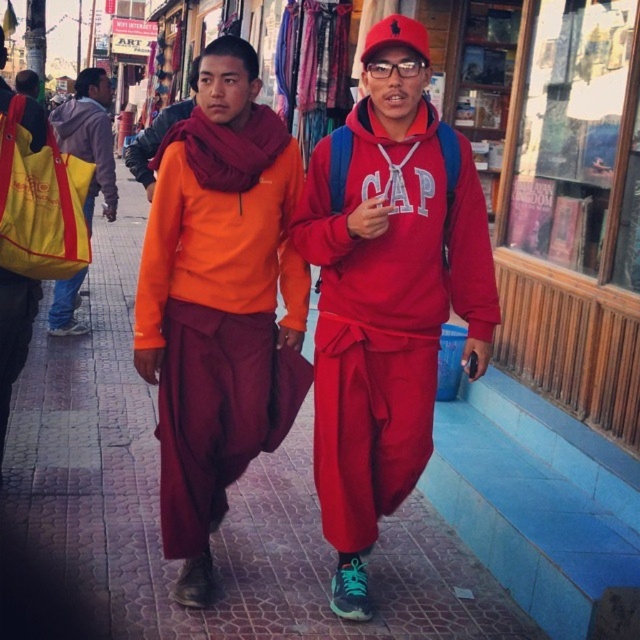
Is matte orange sweater at center smaller than maroon cotton robe at center?

No.

Is point (340, 608) closer to camera compared to point (173, 168)?

No, it is not.

What do you see at coordinates (387, 292) in the screenshot? This screenshot has width=640, height=640. I see `matte orange sweater at center` at bounding box center [387, 292].

Find the location of `matte orange sweater at center`. matte orange sweater at center is located at coordinates (387, 292).

Between point (168, 429) and point (324, 176), which one is positioned in front?

Point (168, 429)

Measure the distance between point (228, 300) and camera.

Point (228, 300) and camera are 2.81 meters apart.

Does point (161, 253) lie in front of point (330, 316)?

Yes, it is in front of point (330, 316).

Find the location of a particular element. maroon cotton robe at center is located at coordinates (220, 310).

Does maroon cotton robe at center have a lesser height compared to yellow fabric bag at left?

In fact, maroon cotton robe at center may be taller than yellow fabric bag at left.

Does maroon cotton robe at center have a greater width compared to yellow fabric bag at left?

Correct, the width of maroon cotton robe at center exceeds that of yellow fabric bag at left.

Is point (289, 224) closer to camera compared to point (67, 128)?

Yes, point (289, 224) is closer to viewer.

The image size is (640, 640). I want to click on maroon cotton robe at center, so click(x=220, y=310).